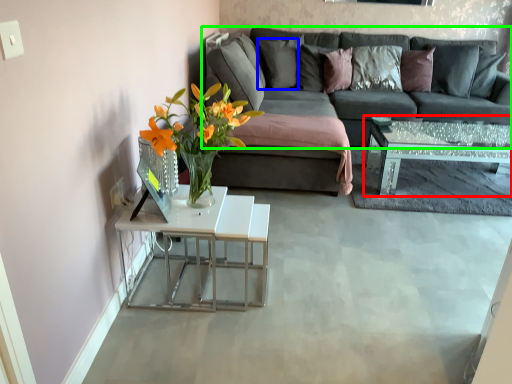
Question: Which is farther away from coffee table (highlighted by a red box)? pillow (highlighted by a blue box) or studio couch (highlighted by a green box)?

Choices:
 (A) pillow
 (B) studio couch

Answer: (A)